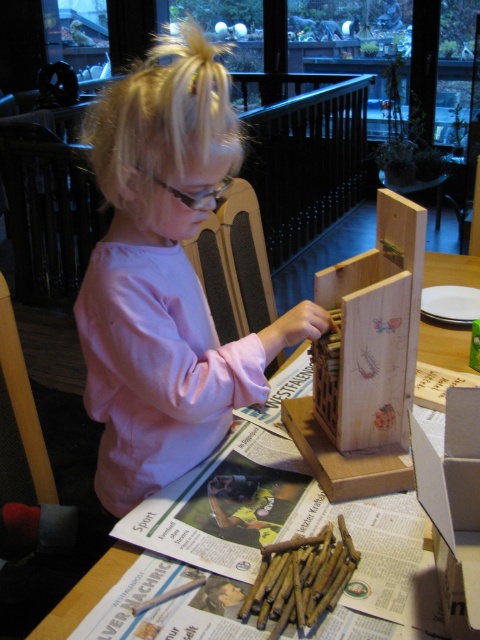
Is point (348, 324) behind point (304, 579)?

Yes, it is behind point (304, 579).

Which of these two, wooden box at center or wooden pencils at center, stands taller?

wooden box at center is taller.

Who is more distant from viewer, [406,387] or [288,605]?

The point [406,387] is behind.

Image resolution: width=480 pixels, height=640 pixels. Find the location of `wooden box at center`. wooden box at center is located at coordinates (373, 332).

Does pink matte shirt at center have a lesser width compared to wooden table at center?

No.

Is pink matte shirt at center below wooden table at center?

Yes.

Locate an element on the screen. pink matte shirt at center is located at coordinates (165, 276).

Find the location of a particular element. Image resolution: width=480 pixels, height=640 pixels. pink matte shirt at center is located at coordinates (165, 276).

Does pink matte shirt at center appear over wooden box at center?

Yes.

Can you confirm if pink matte shirt at center is thinner than wooden box at center?

No.

Find the location of a particular element. This screenshot has height=640, width=480. pink matte shirt at center is located at coordinates (165, 276).